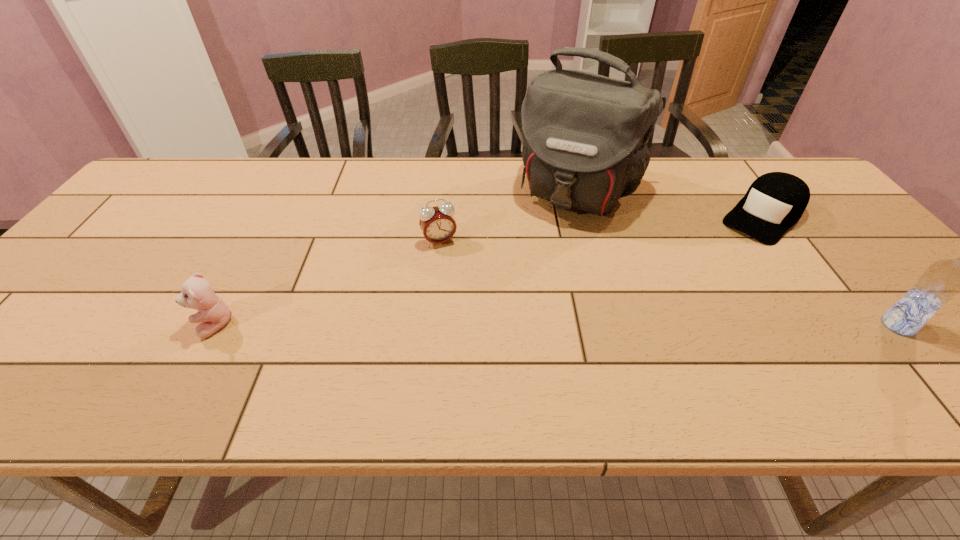
You are a GUI agent. You are given a task and a screenshot of the screen. Output one action in this format:
    pyautogui.click(x=<x>, y=<y>)
    Task: Click on the free location at the right edge
    
    Given the screenshot: What is the action you would take?
    pyautogui.click(x=891, y=273)

This screenshot has height=540, width=960. In order to click on free space between the cap and the tallest object in this screenshot , I will do 671,205.

The image size is (960, 540). Find the location of `free point between the shortest object and the teddy bear`. free point between the shortest object and the teddy bear is located at coordinates (489, 272).

Identify the location of vacant area that lies between the vodka and the shoulder bag. (738, 259).

Locate an element on the screen. blank region between the cap and the shoulder bag is located at coordinates (671, 205).

In order to click on vacant region between the shortest object and the second tallest object in this screenshot , I will do `click(830, 272)`.

I want to click on free space between the alarm clock and the third object from right to left, so click(x=510, y=217).

Locate an element on the screen. blank region between the cap and the second object from left to right is located at coordinates (601, 230).

The width and height of the screenshot is (960, 540). I want to click on unoccupied position between the shortest object and the tallest object, so click(x=671, y=205).

The image size is (960, 540). In order to click on vacant area that lies between the leftmost object and the vodka in this screenshot , I will do `click(556, 326)`.